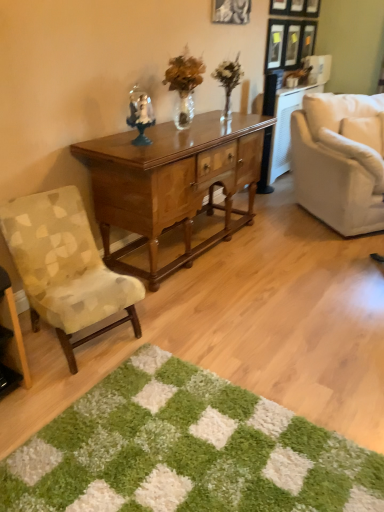
Identify the location of empty space that is in between patterned fabric chair at left, which is the 1th chair from front to back, and green shaggy rug at lower center. (94, 380).